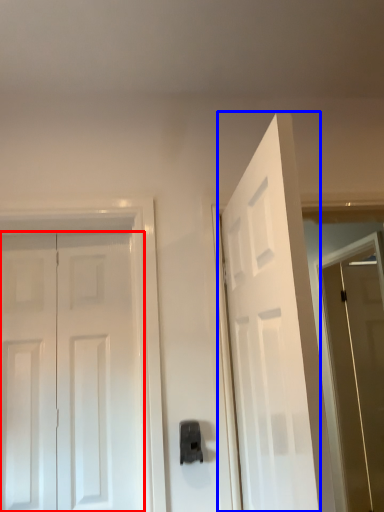
Question: Which of the following is the closest to the observer, door (highlighted by a red box) or door (highlighted by a blue box)?

Choices:
 (A) door
 (B) door

Answer: (B)